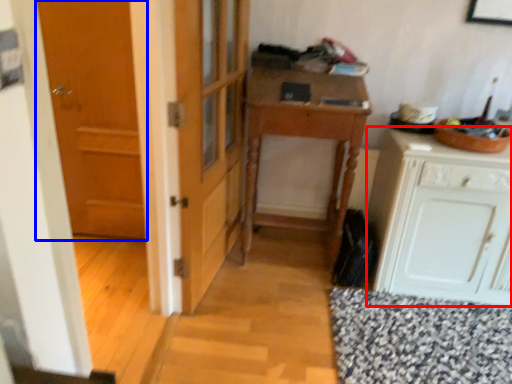
Question: Which object appears farthest to the camera in this image, cabinetry (highlighted by a red box) or door (highlighted by a blue box)?

Choices:
 (A) cabinetry
 (B) door

Answer: (B)